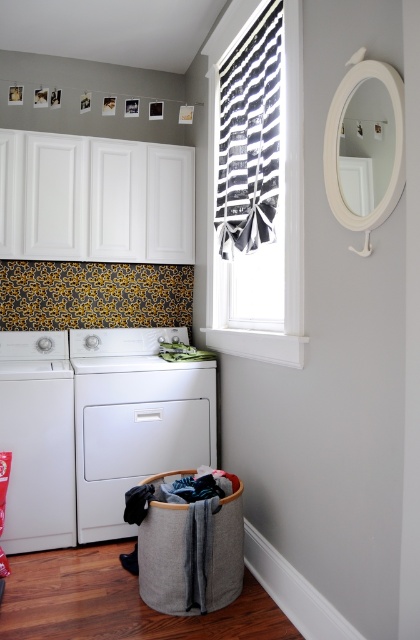
You are standing in the laundry room corner and see the point marked as point (257, 186). What object does this point correspond to?

The point (257, 186) corresponds to the black and white striped fabric at center.

You are standing in the laundry room and see the point marked at coordinates (133, 419). Based on the scene description, what object is this point located on?

The point at coordinates (133, 419) is located on the white matte washing machine at lower left.